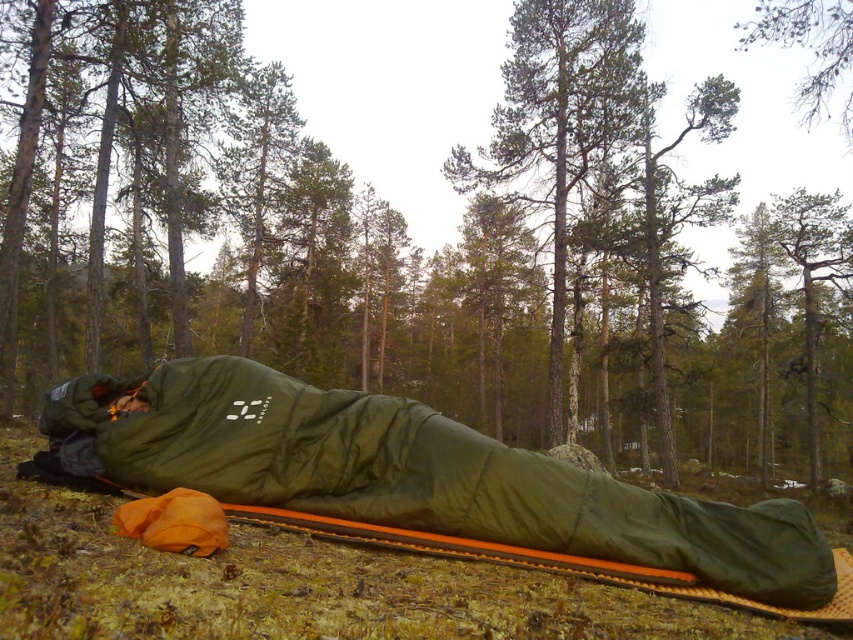
Is olive green fabric sleeping bag at center behind green textured tree at center?

No, olive green fabric sleeping bag at center is in front of green textured tree at center.

Is olive green fabric sleeping bag at center taller than green textured tree at center?

Incorrect, olive green fabric sleeping bag at center's height is not larger of green textured tree at center's.

At what (x,y) coordinates should I click in order to perform the action: click on olive green fabric sleeping bag at center. Please return your answer as a coordinate pair (x, y). This screenshot has width=853, height=640. Looking at the image, I should click on (x=415, y=476).

Does green textured tree at center have a lesser width compared to green matte tree at upper center?

Yes, green textured tree at center is thinner than green matte tree at upper center.

Is point (616, 106) behind point (836, 20)?

Yes.

Locate an element on the screen. This screenshot has height=640, width=853. green textured tree at center is located at coordinates (558, 122).

Measure the distance between point (363, 428) and camera.

Point (363, 428) is 13.77 feet from camera.

Who is taller, olive green fabric sleeping bag at center or green matte tree at upper center?

With more height is green matte tree at upper center.

Does point (399, 490) come farther from viewer compared to point (813, 12)?

That is False.

Find the location of a particular element. This screenshot has height=640, width=853. olive green fabric sleeping bag at center is located at coordinates (415, 476).